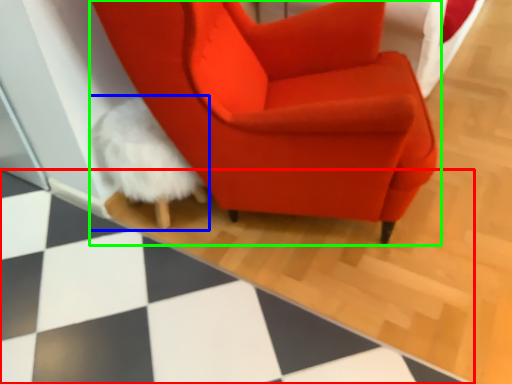
Question: Based on their relative distances, which object is farther from tile (highlighted by a red box)? Choose from bean bag chair (highlighted by a blue box) and chair (highlighted by a green box).

Choices:
 (A) bean bag chair
 (B) chair

Answer: (B)